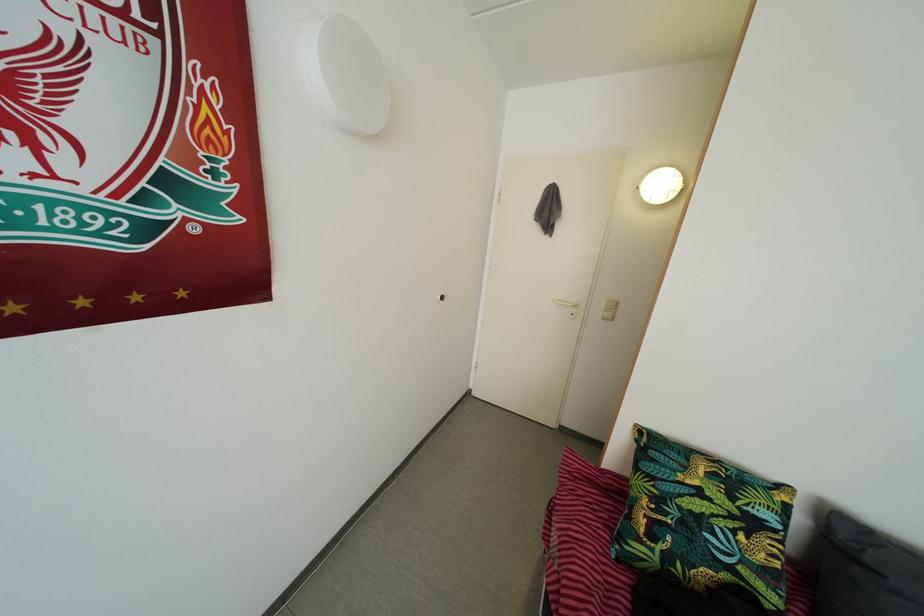
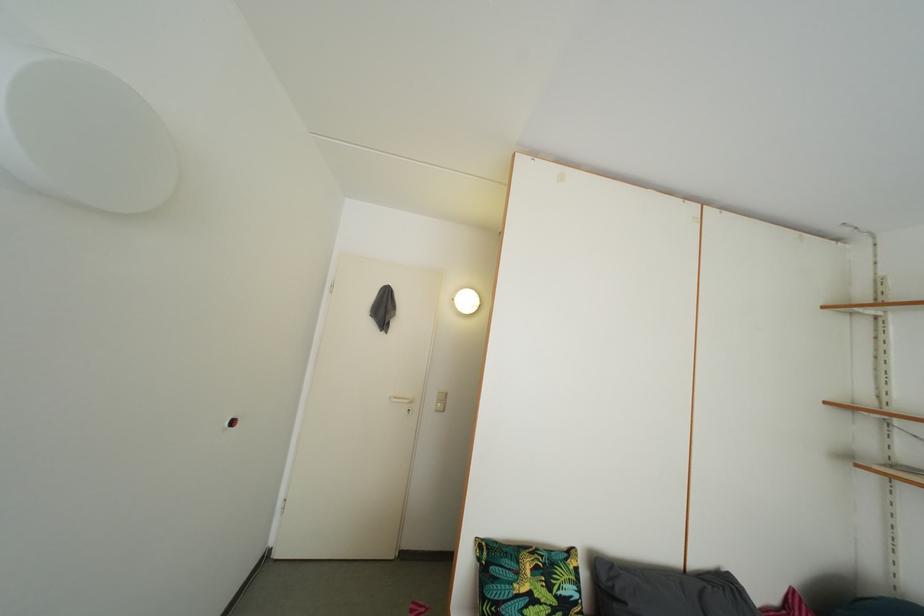
How did the camera likely rotate?

The rotation direction of the camera is right-up.